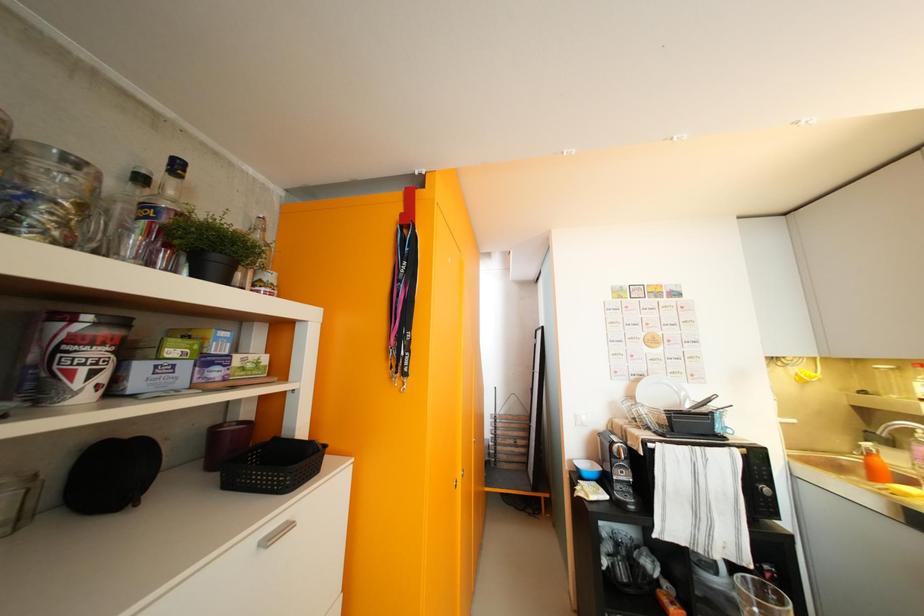
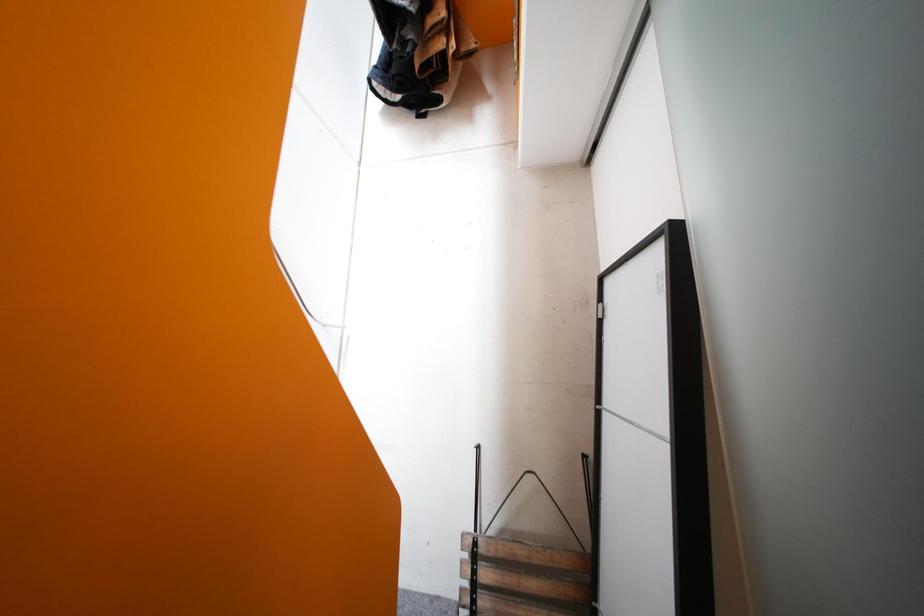
Question: What movement of the cameraman would produce the second image?

Choices:
 (A) Left
 (B) Right
 (C) Forward
 (D) Backward

Answer: (C)